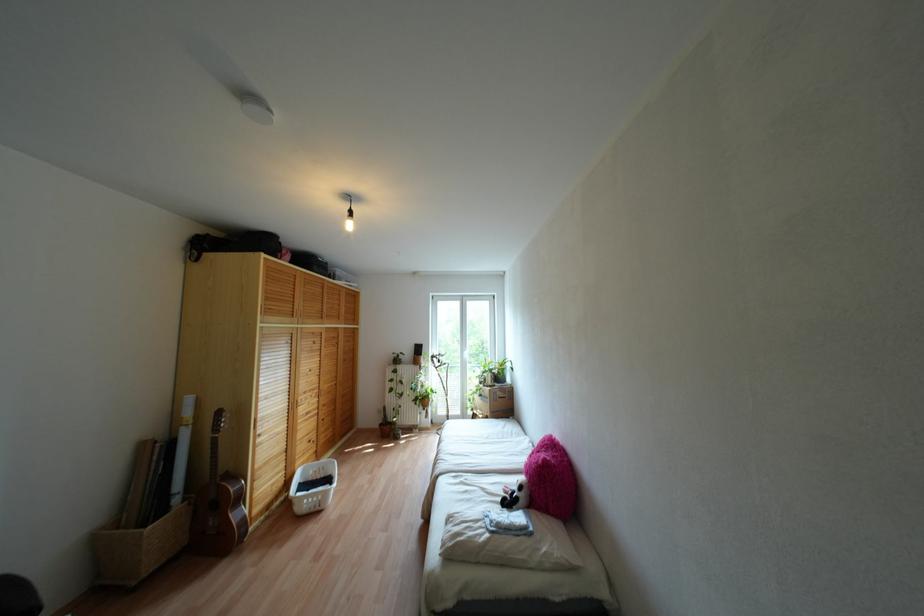
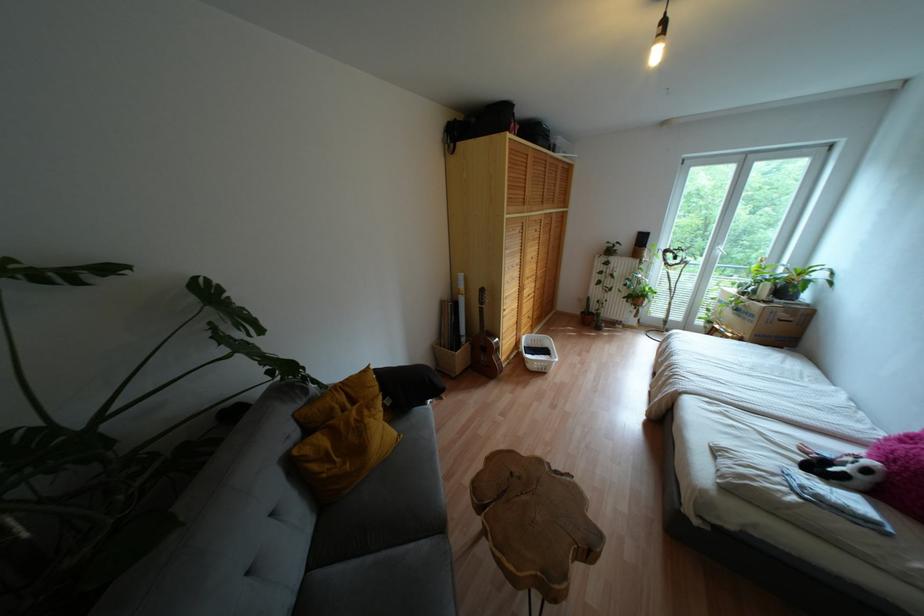
The point at (408, 413) is marked in the first image. Where is the corresponding point in the second image?

(614, 309)